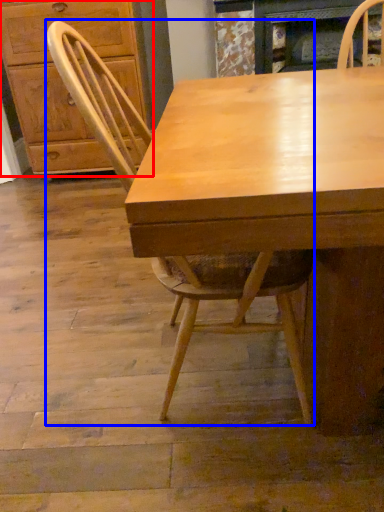
Question: Which object appears closest to the camera in this image, cabinetry (highlighted by a red box) or chair (highlighted by a blue box)?

Choices:
 (A) cabinetry
 (B) chair

Answer: (B)